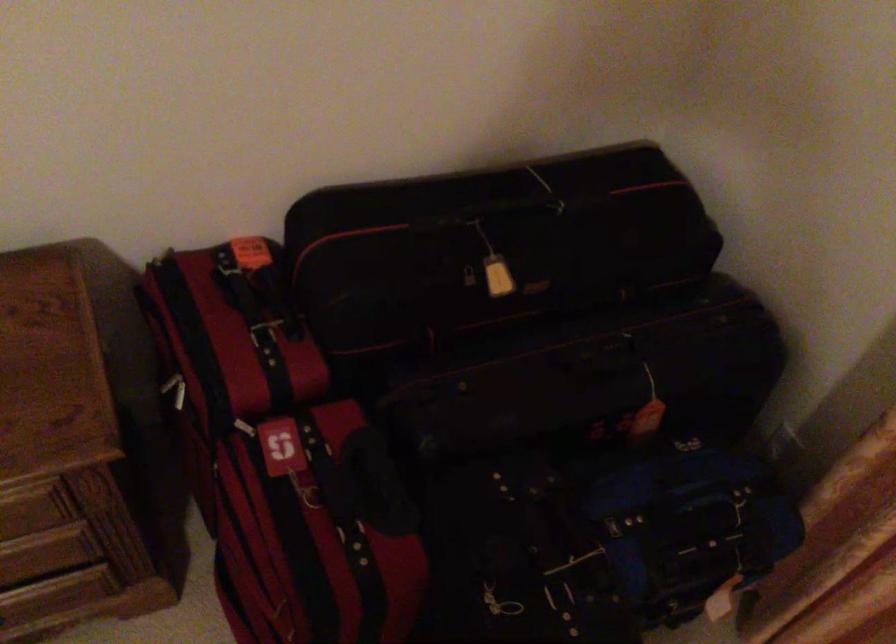
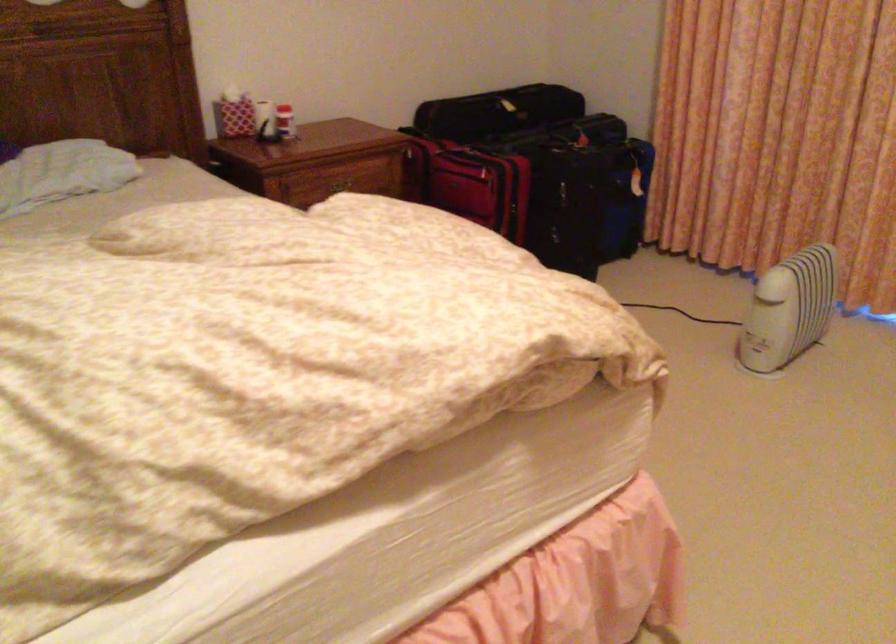
The point at (286, 550) is marked in the first image. Where is the corresponding point in the second image?

(469, 183)